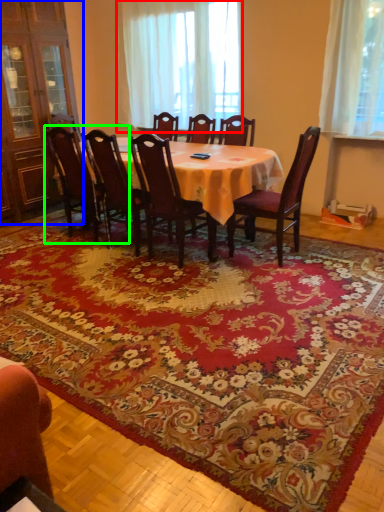
Question: Estimate the real-world distances between objects in this image. Which object is closer to curtain (highlighted by a red box), armoire (highlighted by a blue box) or chair (highlighted by a green box)?

Choices:
 (A) armoire
 (B) chair

Answer: (A)